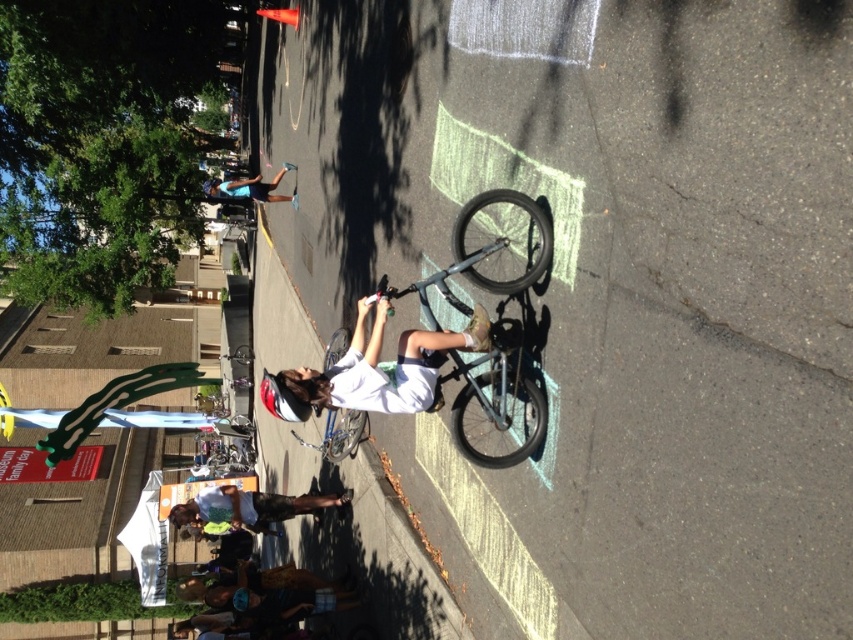
In the scene shown: Can you confirm if white matte shirt at center is positioned above shiny metallic bicycle at center?

Incorrect, white matte shirt at center is not positioned above shiny metallic bicycle at center.

Can you confirm if white matte shirt at center is thinner than shiny metallic bicycle at center?

No.

In order to click on white matte shirt at center in this screenshot , I will do `click(380, 369)`.

This screenshot has width=853, height=640. Identify the location of white matte shirt at center. (380, 369).

Is shiny metallic bicycle at center positioned at the back of white t-shirt at center?

No, it is not.

Does point (479, 458) come farther from viewer compared to point (241, 490)?

That is False.

The height and width of the screenshot is (640, 853). Identify the location of shiny metallic bicycle at center. (485, 253).

Can you confirm if white matte shirt at center is positioned above blue fabric shirt at upper center?

No.

Who is more forward, (x=433, y=353) or (x=247, y=182)?

Point (x=433, y=353)

Describe the element at coordinates (380, 369) in the screenshot. I see `white matte shirt at center` at that location.

Find the location of a particular element. The width and height of the screenshot is (853, 640). white matte shirt at center is located at coordinates (380, 369).